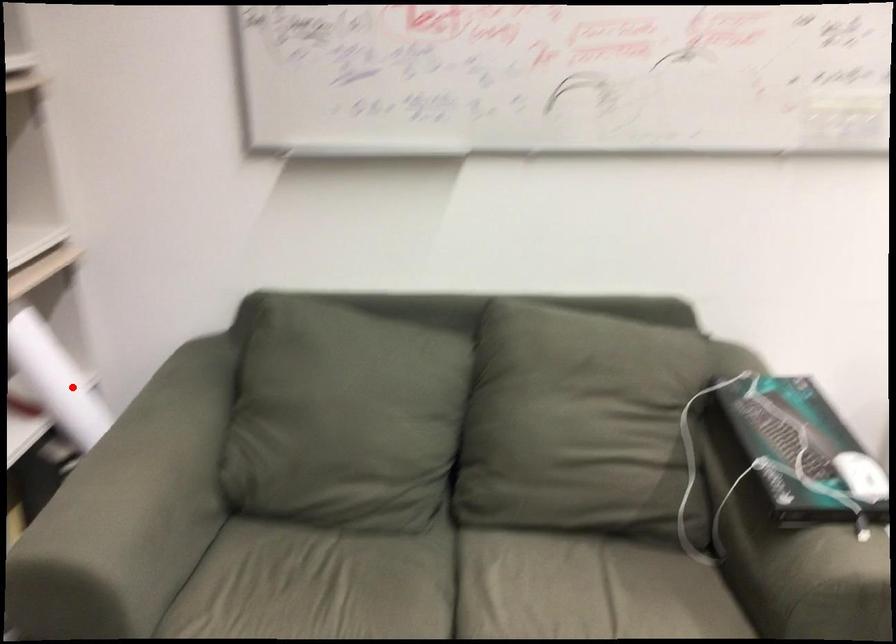
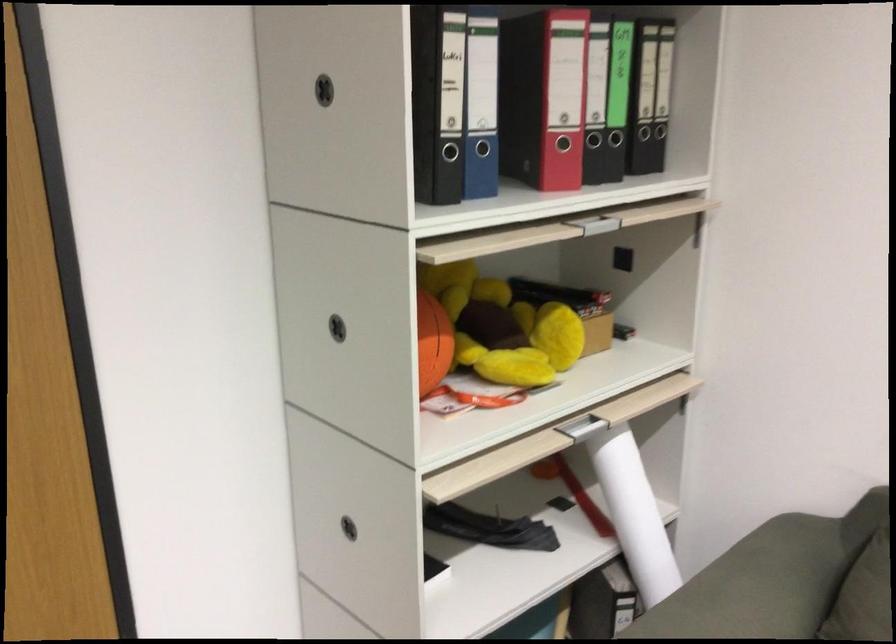
Question: I am providing you with two images of the same scene from different viewpoints. In image1, a red point is highlighted. Considering the same 3D point in image2, which of the following is correct?

Choices:
 (A) It is closer
 (B) It is farther

Answer: (A)